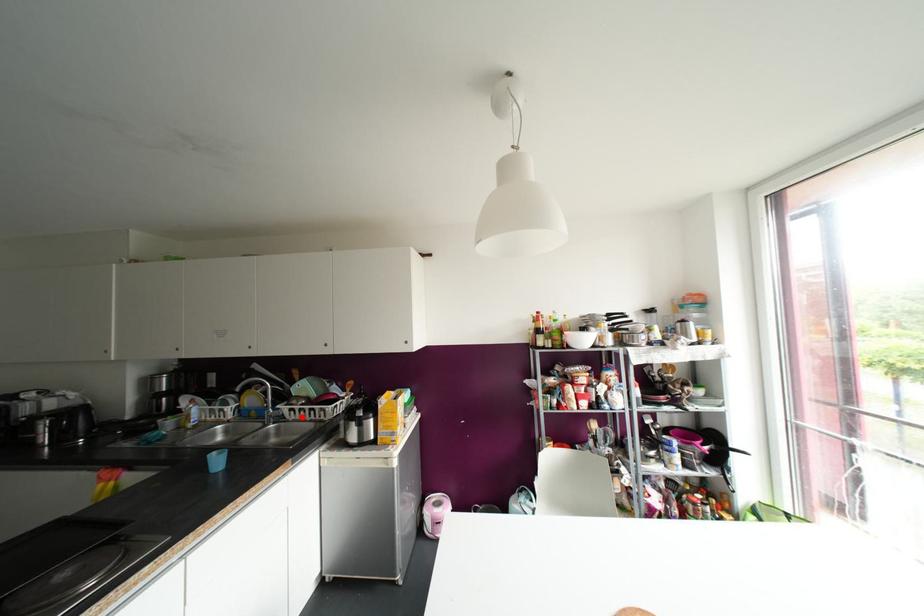
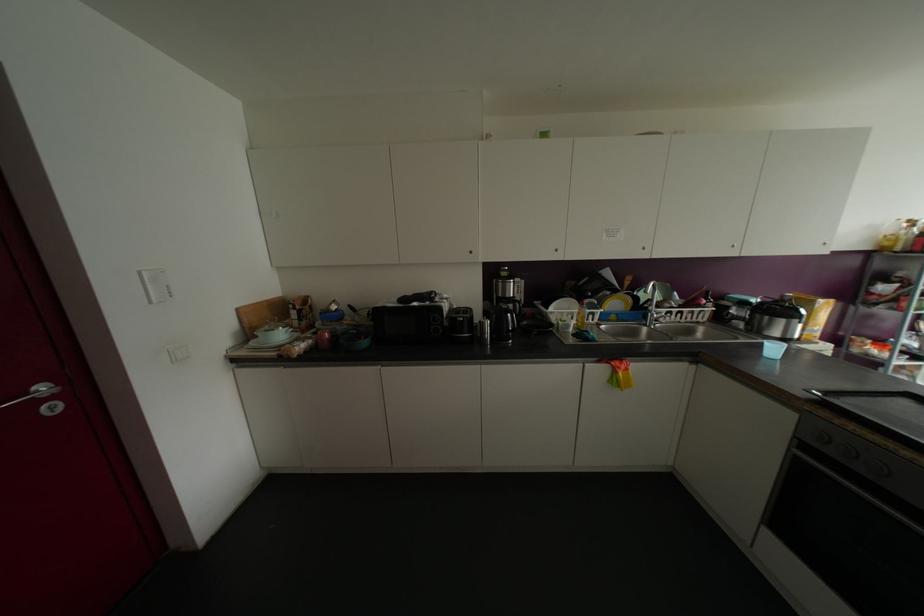
In the second image, find the point that corresponds to the highlighted location in the first image.

(677, 318)